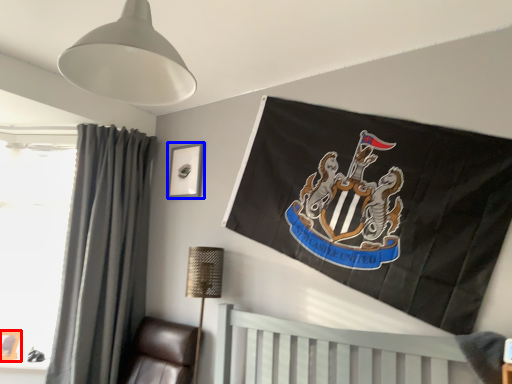
Question: Which object is closer to the camera taking this photo, picture frame (highlighted by a red box) or picture frame (highlighted by a blue box)?

Choices:
 (A) picture frame
 (B) picture frame

Answer: (A)